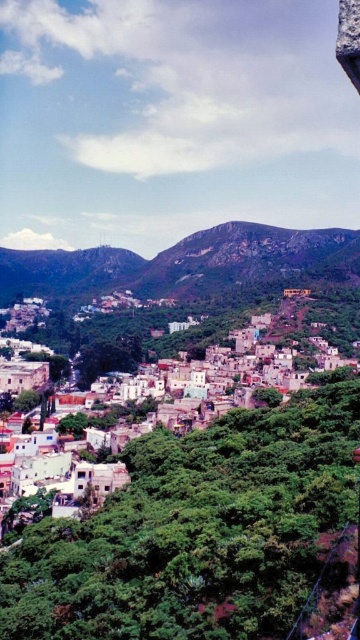
Is green rocky mountain at center above white matte buildings at lower left?

Yes, green rocky mountain at center is above white matte buildings at lower left.

Can you confirm if green rocky mountain at center is positioned to the left of white matte buildings at lower left?

Yes, green rocky mountain at center is to the left of white matte buildings at lower left.

Which is in front, point (110, 285) or point (321, 429)?

Positioned in front is point (321, 429).

The image size is (360, 640). I want to click on green rocky mountain at center, so click(x=183, y=262).